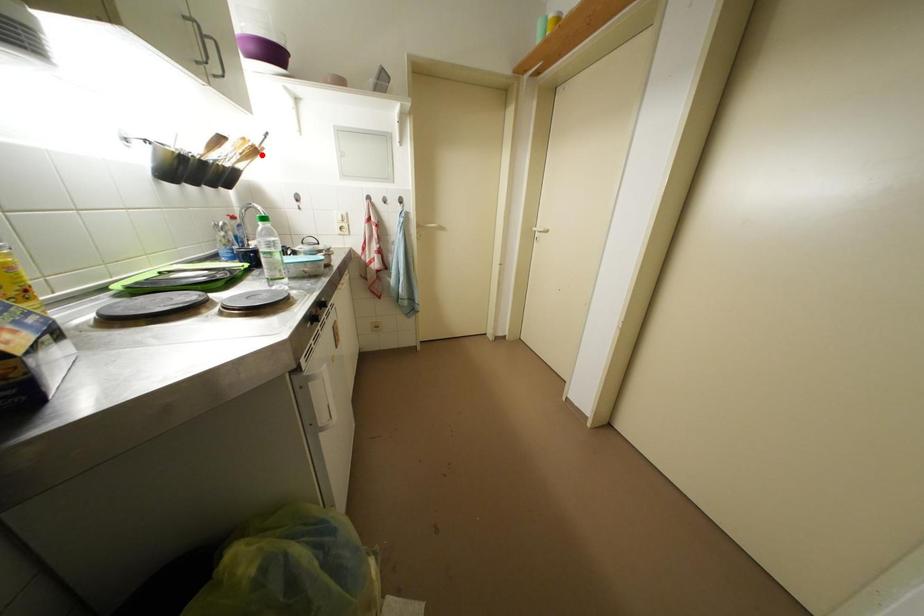
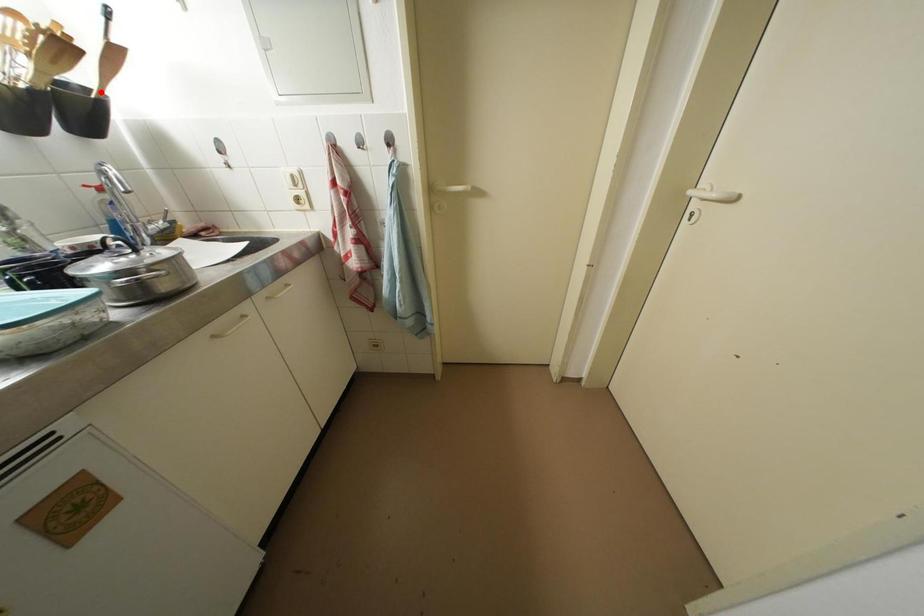
I am providing you with two images of the same scene from different viewpoints. A red point is marked on the first image and another point is marked on the second image. Do the highlighted points in image1 and image2 indicate the same real-world spot?

No